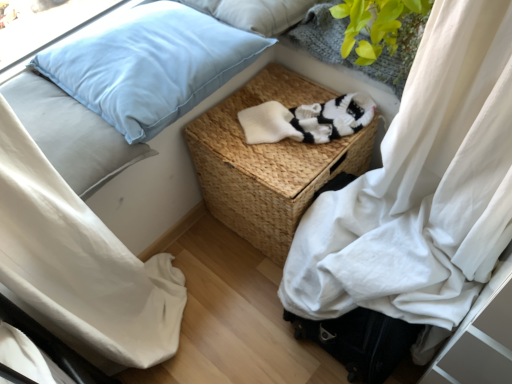
Question: Considering the relative sizes of white knitted socks at center and light blue fabric pillow at upper left, which ranks as the third pillow in top-to-bottom order, in the image provided, is white knitted socks at center thinner than light blue fabric pillow at upper left, which ranks as the third pillow in top-to-bottom order,?

Choices:
 (A) no
 (B) yes

Answer: (B)

Question: Could you tell me if white knitted socks at center is turned towards light blue fabric pillow at upper left, which ranks as the third pillow in top-to-bottom order?

Choices:
 (A) no
 (B) yes

Answer: (A)

Question: Is white knitted socks at center with light blue fabric pillow at upper left, which ranks as the third pillow in top-to-bottom order?

Choices:
 (A) yes
 (B) no

Answer: (B)

Question: From a real-world perspective, is white knitted socks at center physically above light blue fabric pillow at upper left, which ranks as the third pillow in top-to-bottom order?

Choices:
 (A) yes
 (B) no

Answer: (B)

Question: From the image's perspective, is white knitted socks at center located beneath light blue fabric pillow at upper left, which ranks as the third pillow in top-to-bottom order?

Choices:
 (A) yes
 (B) no

Answer: (B)

Question: Would you say white knitted socks at center is inside or outside light blue fabric pillow at upper left, which is the second pillow from bottom to top?

Choices:
 (A) outside
 (B) inside

Answer: (A)

Question: From a real-world perspective, is white knitted socks at center physically located above or below light blue fabric pillow at upper left, which is the second pillow from bottom to top?

Choices:
 (A) above
 (B) below

Answer: (B)

Question: Is white knitted socks at center bigger or smaller than light blue fabric pillow at upper left, which is the second pillow from bottom to top?

Choices:
 (A) big
 (B) small

Answer: (B)

Question: Is white knitted socks at center in front of or behind light blue fabric pillow at upper left, positioned as the second pillow in top-to-bottom order, in the image?

Choices:
 (A) front
 (B) behind

Answer: (B)

Question: Would you say green knitted plant at upper right is inside or outside white knitted socks at center?

Choices:
 (A) inside
 (B) outside

Answer: (B)

Question: From a real-world perspective, is green knitted plant at upper right positioned above or below white knitted socks at center?

Choices:
 (A) below
 (B) above

Answer: (B)

Question: Visually, is green knitted plant at upper right positioned to the left or to the right of white knitted socks at center?

Choices:
 (A) left
 (B) right

Answer: (B)

Question: Considering the positions of green knitted plant at upper right and white knitted socks at center in the image, is green knitted plant at upper right taller or shorter than white knitted socks at center?

Choices:
 (A) short
 (B) tall

Answer: (B)

Question: Would you say light blue fabric pillow at upper left, positioned as the second pillow in top-to-bottom order, is to the left or to the right of light blue fabric pillow at upper left, which ranks as the third pillow in top-to-bottom order, in the picture?

Choices:
 (A) right
 (B) left

Answer: (A)

Question: Is point (217, 54) positioned closer to the camera than point (96, 175)?

Choices:
 (A) closer
 (B) farther

Answer: (B)